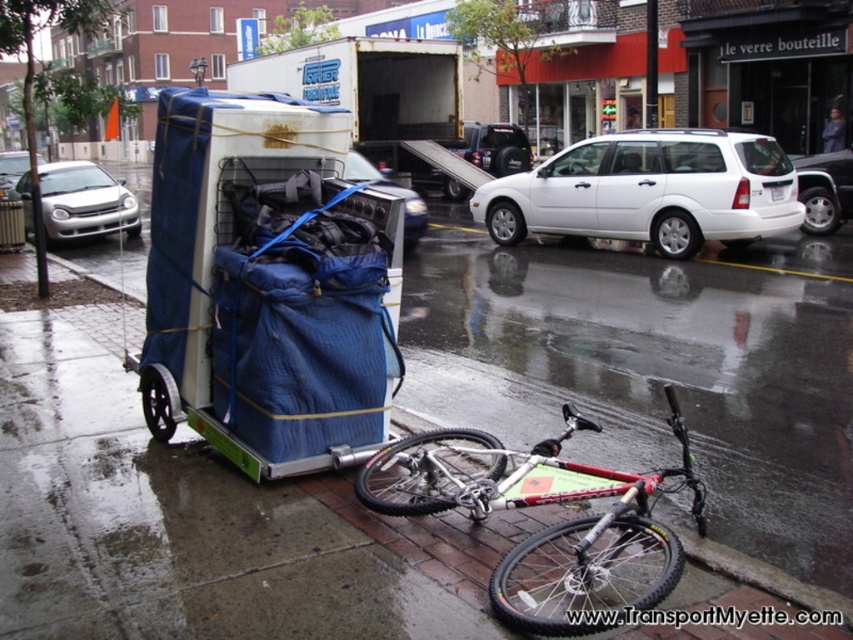
You are standing at the point marked as point (635, 176) in the urban street scene. You want to cross the street to reach a nearby coffee shop located 5 meters ahead of you. Considering the parked cars and the bicycle trailer, is there enough space between the white station wagon and the moving truck to safely cross without getting wet from the rain?

The distance between you and the viewer is 11.72 meters, but the question mentions crossing 5 meters ahead. Since the parked cars and bicycle trailer are on the sidewalk, there should be enough space between the white station wagon and the moving truck to cross safely. However, the rain might make the pavement slippery, so caution is advised.

You are a delivery person trying to park your van between the white matte station wagon at center and the silver metallic sedan at right. Based on the scene, can you fit your van there?

The white matte station wagon at center is much taller than the silver metallic sedan at right, but since van height isn not mentioned, it might still fit if there is enough space between them horizontally.

You are a delivery person with a 2.5 meter long trailer. You need to park your bicycle and trailer between the white matte station wagon at center and the silver metallic sedan at right. Is there enough space for the trailer?

The white matte station wagon at center and silver metallic sedan at right are 3.11 meters apart from each other. Since the trailer is 2.5 meters long, there is enough space to park the trailer between them as 3.11 meters is greater than 2.5 meters.